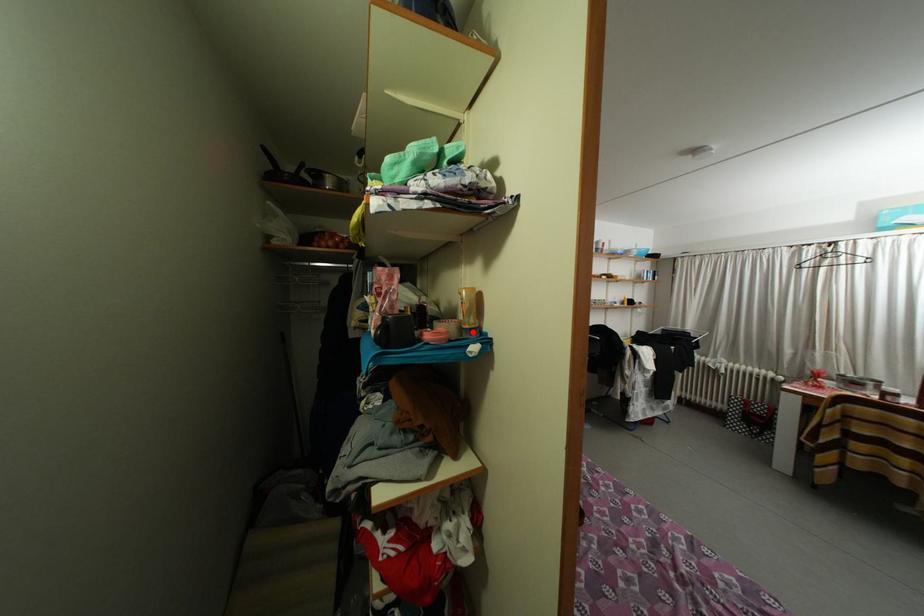
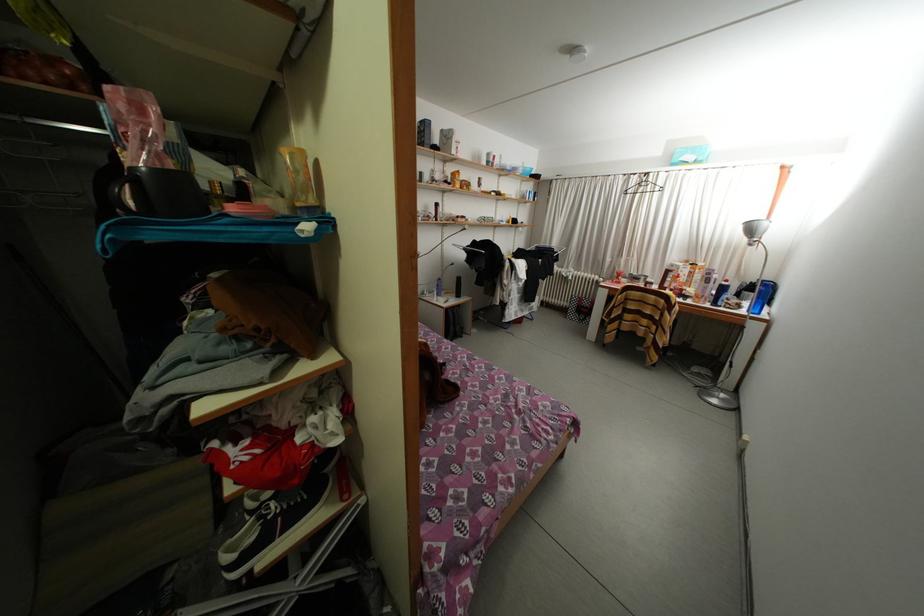
The point at the highlighted location is marked in the first image. Where is the corresponding point in the second image?

(306, 209)